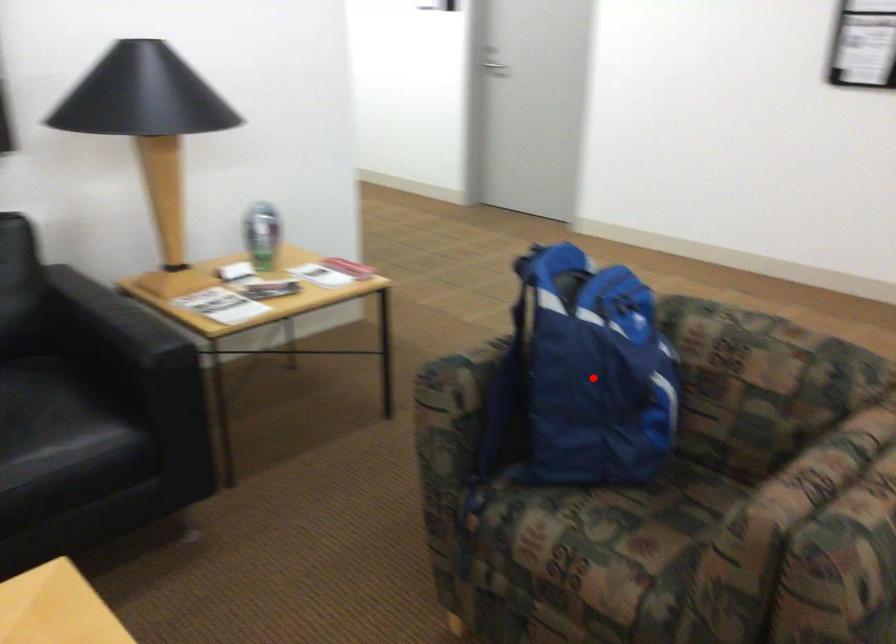
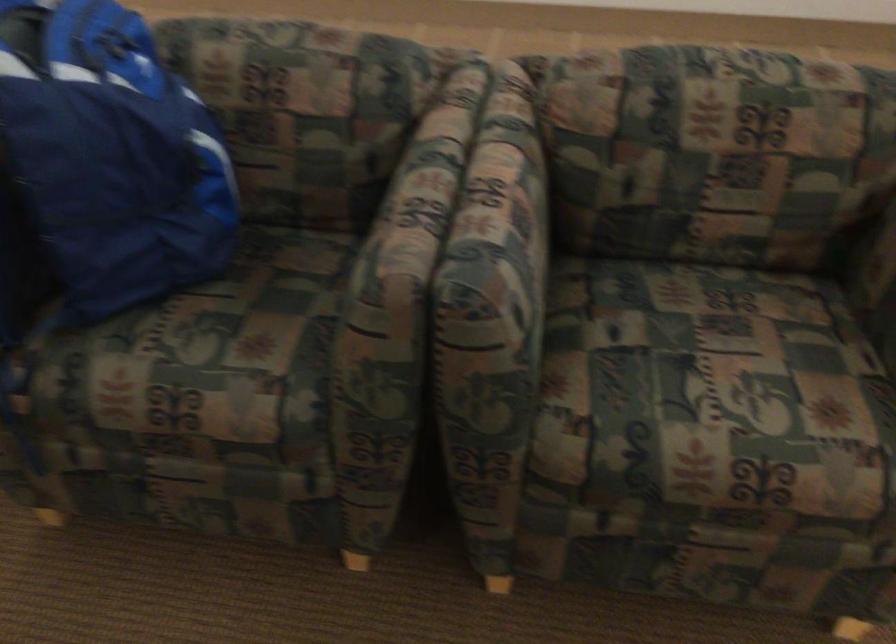
In the second image, find the point that corresponds to the highlighted location in the first image.

(112, 155)